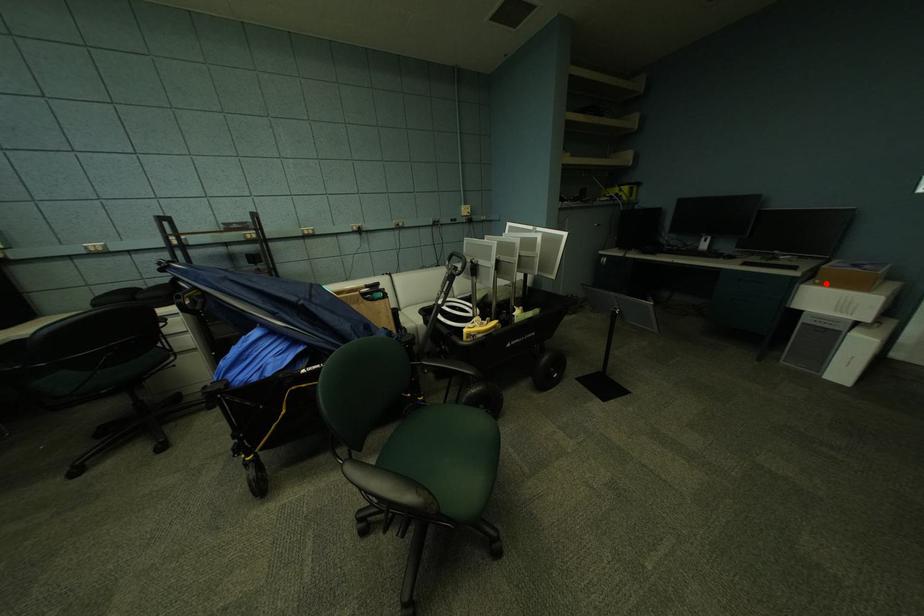
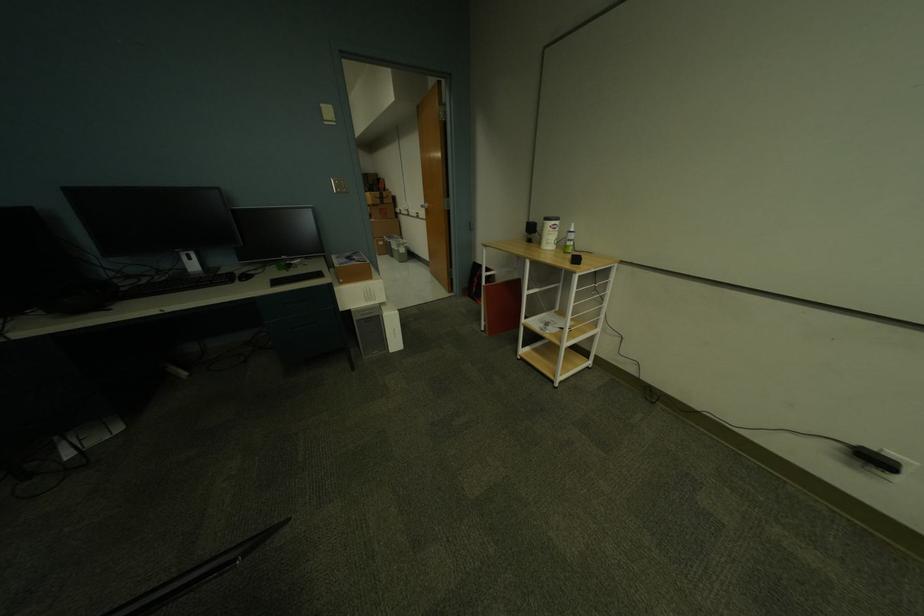
Find the pixel in the second image that matches the highlighted location in the first image.

(349, 282)